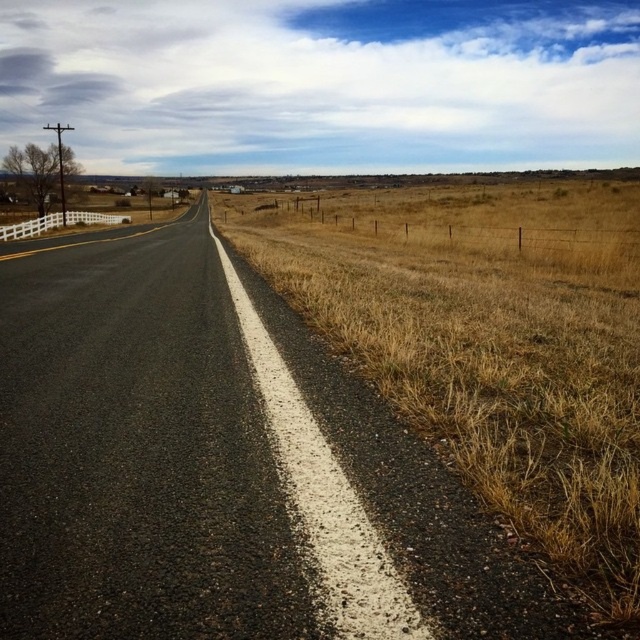
From the picture: You are a cyclist planning to ride along the black asphalt road at center. You notice the dry grass at right is wider than the road. How does the width of the road compare to the dry grass area on its right side?

The black asphalt road at center is thinner than dry grass at right, meaning the dry grass area on the right side is wider than the road itself.

You are driving a car and see two points on the road ahead. The first point is at coordinates point (256,636), and the second point is at point (444,348). Which point will you reach first while driving forward?

Point (256,636) is closer to the camera than point (444,348), so you will reach point (256,636) first while driving forward.

You are a driver approaching the black asphalt road at center and see the dry grass at right. Which area takes up more space in the image?

The dry grass at right takes up more space in the image than the black asphalt road at center because the black asphalt road at center has a smaller size compared to dry grass at right.